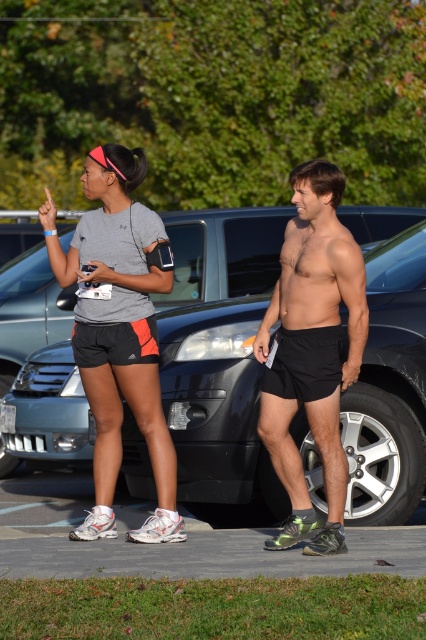
Question: Which point is closer to the camera taking this photo?

Choices:
 (A) (311, 508)
 (B) (25, 420)
 (C) (150, 385)

Answer: (A)

Question: Is shiny black shorts at center thinner than black mesh shorts at center?

Choices:
 (A) yes
 (B) no

Answer: (B)

Question: Which is nearer to the black mesh shorts at center?

Choices:
 (A) matte gray shirt at center
 (B) shiny black shorts at center

Answer: (A)

Question: Which of these objects is positioned farthest from the matte gray shirt at center?

Choices:
 (A) shiny black shorts at center
 (B) black mesh shorts at center
 (C) metallic gray car at center

Answer: (C)

Question: Is metallic gray car at center thinner than shiny black shorts at center?

Choices:
 (A) yes
 (B) no

Answer: (B)

Question: Is metallic gray car at center smaller than shiny black shorts at center?

Choices:
 (A) yes
 (B) no

Answer: (B)